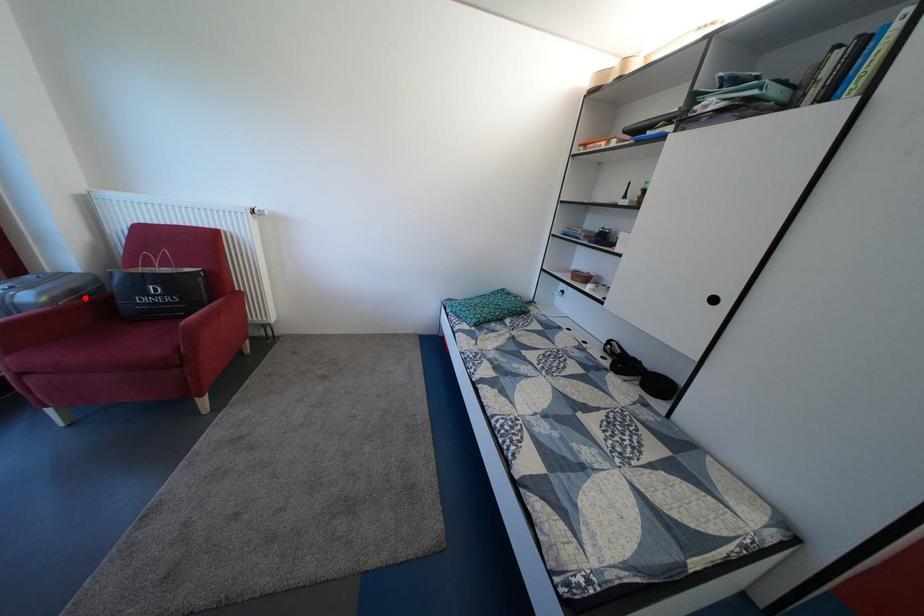
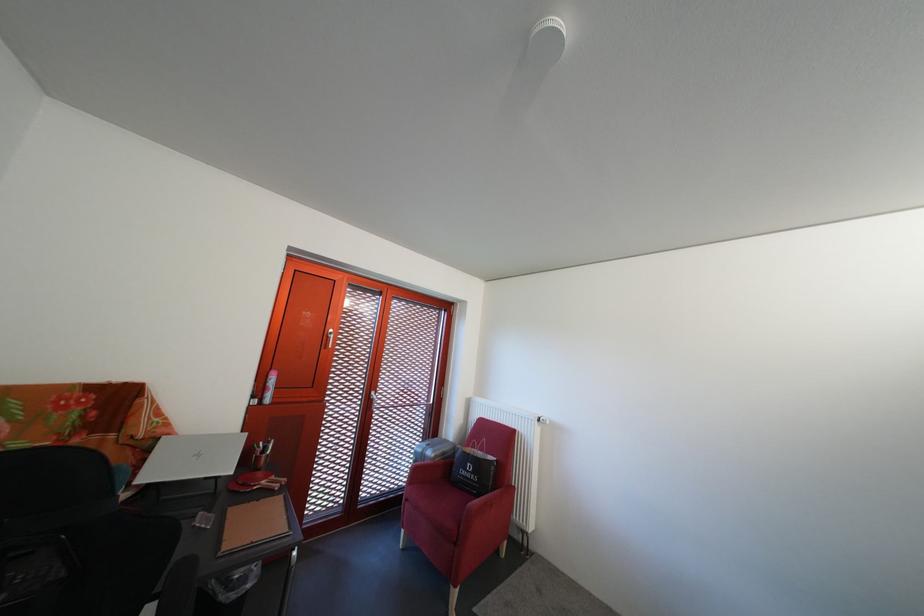
Locate, in the second image, the point that corresponds to the highlighted location in the first image.

(455, 460)